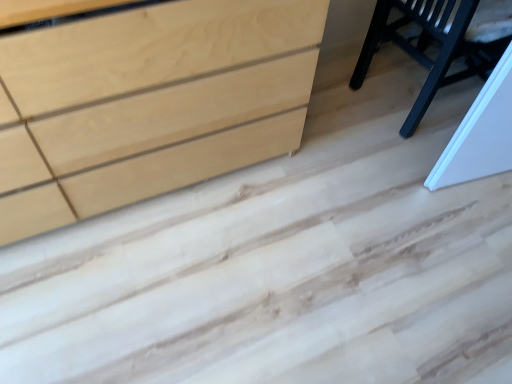
The width and height of the screenshot is (512, 384). Find the location of `free space to the right of natural wood chest of drawers at lower left`. free space to the right of natural wood chest of drawers at lower left is located at coordinates (339, 202).